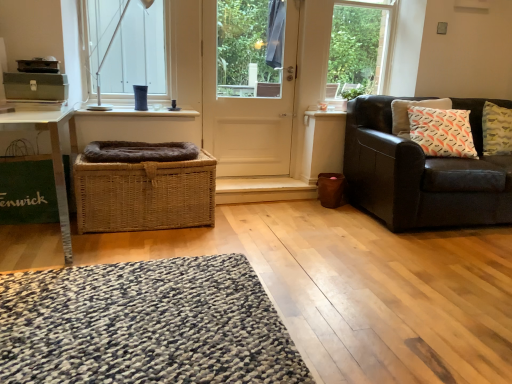
This screenshot has height=384, width=512. I want to click on vacant area on top of textured gray mat at lower left (from a real-world perspective), so click(x=129, y=316).